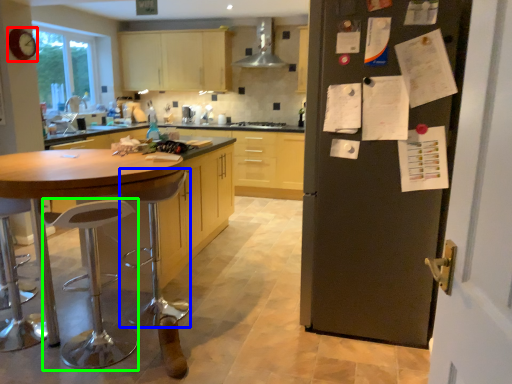
Question: Which is farther away from clock (highlighted by a red box)? bar stool (highlighted by a blue box) or bar stool (highlighted by a green box)?

Choices:
 (A) bar stool
 (B) bar stool

Answer: (A)